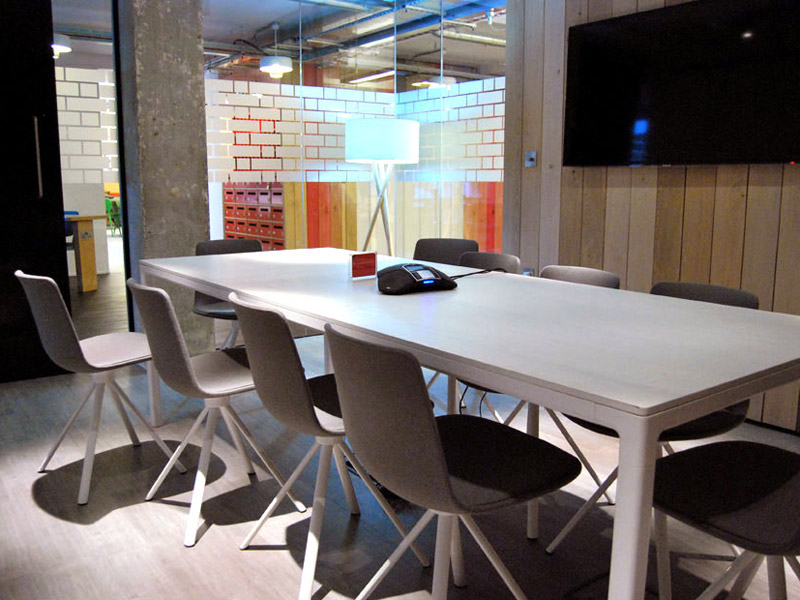
Image resolution: width=800 pixels, height=600 pixels. I want to click on chair at the bottom of the table, so click(x=757, y=515).